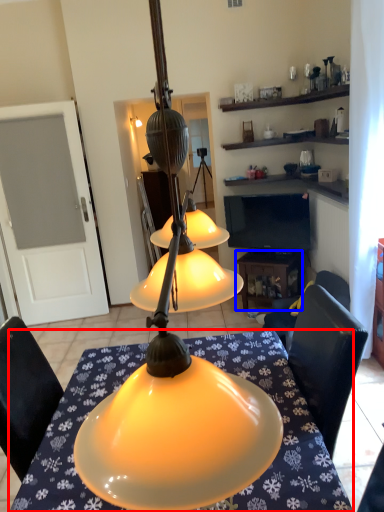
Question: Which of the following is the closest to the observer, desk (highlighted by a red box) or table (highlighted by a blue box)?

Choices:
 (A) desk
 (B) table

Answer: (A)